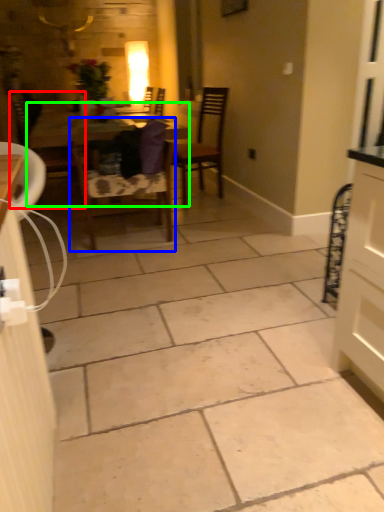
Question: Which object is positioned farthest from chair (highlighted by a red box)? Select from chair (highlighted by a blue box) and table (highlighted by a green box).

Choices:
 (A) chair
 (B) table

Answer: (A)